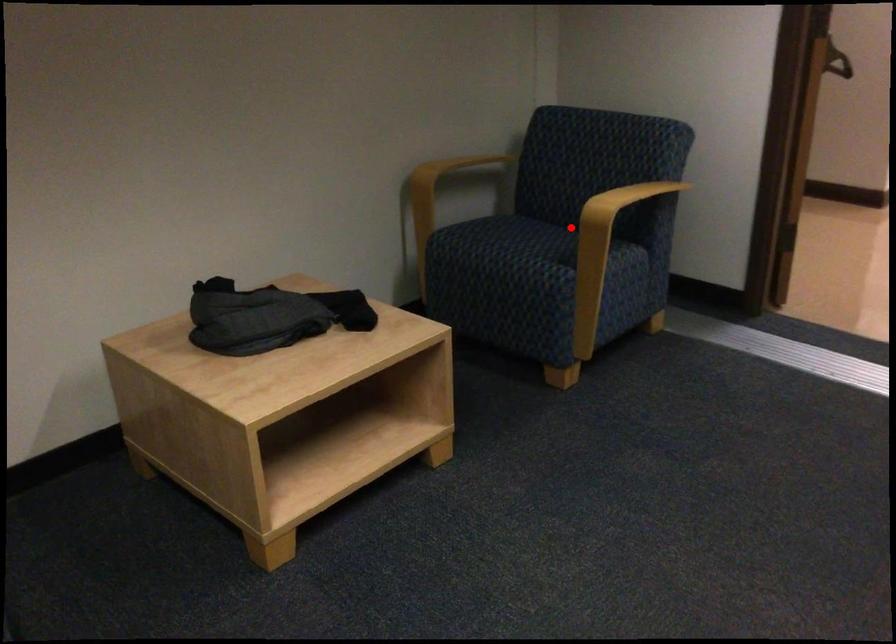
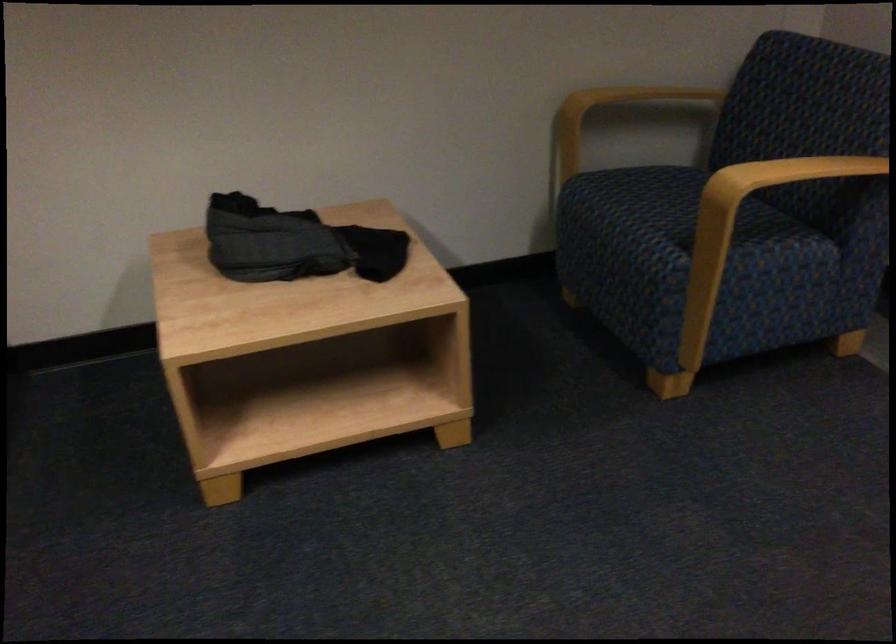
Question: A red point is marked in image1. In image2, is the corresponding 3D point closer to the camera or farther? Reply with the corresponding letter.

Choices:
 (A) The corresponding 3D point is closer.
 (B) The corresponding 3D point is farther.

Answer: (A)